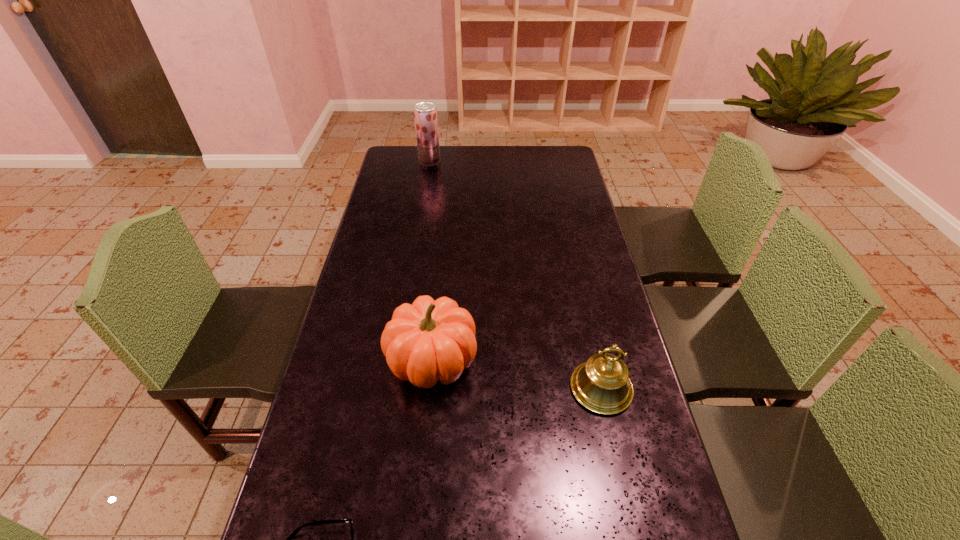
Identify which object is the closest to the rightmost object. Please provide its 2D coordinates. Your answer should be formatted as a tuple, i.e. [(x, y)], where the tuple contains the x and y coordinates of a point satisfying the conditions above.

[(427, 341)]

This screenshot has width=960, height=540. What are the coordinates of `free space in the image that satisfies the following two spatial constraints: 1. on the front side of the pumpkin; 2. on the left side of the farthest object` in the screenshot? It's located at (397, 360).

Find the location of a particular element. The width and height of the screenshot is (960, 540). free spot that satisfies the following two spatial constraints: 1. on the front side of the rightmost object; 2. on the left side of the pumpkin is located at coordinates (429, 388).

I want to click on free point that satisfies the following two spatial constraints: 1. on the front side of the farthest object; 2. on the right side of the rightmost object, so click(x=393, y=388).